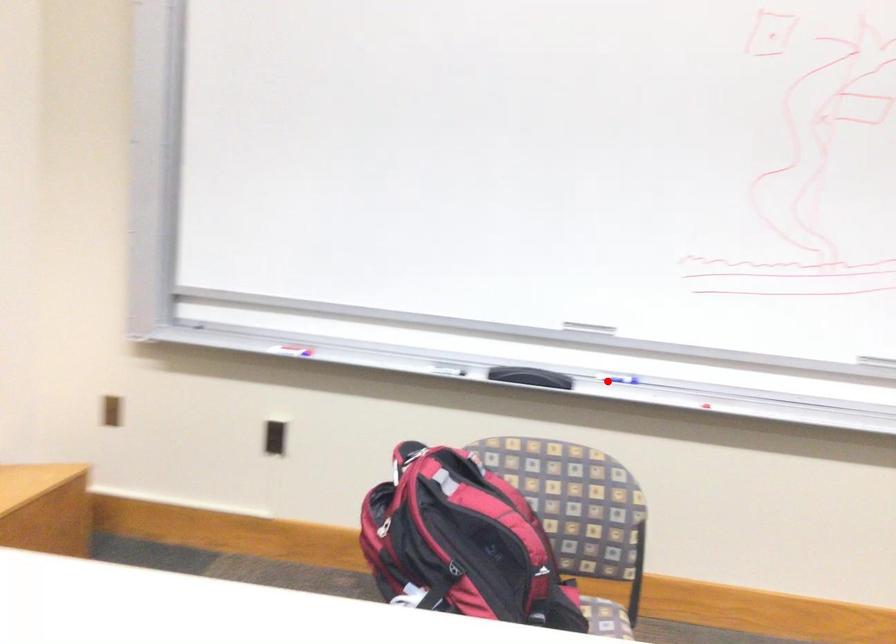
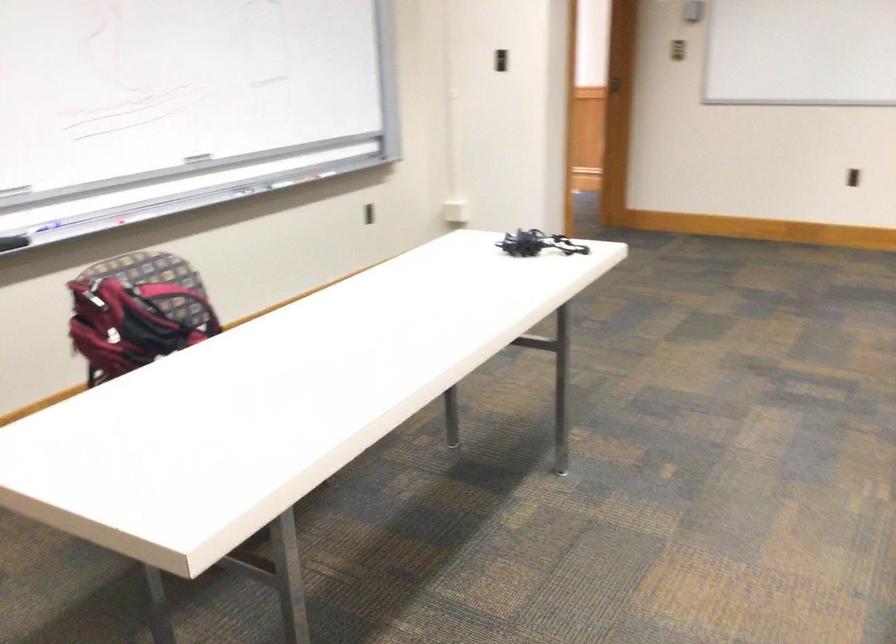
Where in the second image is the point corresponding to the highlighted location from the first image?

(39, 229)